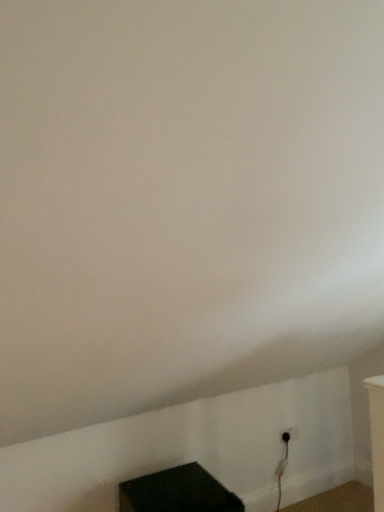
Question: From a real-world perspective, is black plastic outlet at lower right located beneath black matte cube at lower center?

Choices:
 (A) no
 (B) yes

Answer: (A)

Question: Is black plastic outlet at lower right bigger than black matte cube at lower center?

Choices:
 (A) yes
 (B) no

Answer: (B)

Question: Does black plastic outlet at lower right have a greater width compared to black matte cube at lower center?

Choices:
 (A) yes
 (B) no

Answer: (B)

Question: Is black plastic outlet at lower right facing towards black matte cube at lower center?

Choices:
 (A) no
 (B) yes

Answer: (A)

Question: Is black plastic outlet at lower right positioned before black matte cube at lower center?

Choices:
 (A) no
 (B) yes

Answer: (A)

Question: Is black matte cube at lower center surrounded by black plastic outlet at lower right?

Choices:
 (A) no
 (B) yes

Answer: (A)

Question: From a real-world perspective, does black matte cube at lower center stand above black plastic outlet at lower right?

Choices:
 (A) no
 (B) yes

Answer: (A)

Question: Is black matte cube at lower center to the left of black plastic outlet at lower right from the viewer's perspective?

Choices:
 (A) yes
 (B) no

Answer: (A)

Question: Can you confirm if black matte cube at lower center is positioned to the right of black plastic outlet at lower right?

Choices:
 (A) no
 (B) yes

Answer: (A)

Question: Is the position of black matte cube at lower center more distant than that of black plastic outlet at lower right?

Choices:
 (A) no
 (B) yes

Answer: (A)

Question: Is black matte cube at lower center positioned far away from black plastic outlet at lower right?

Choices:
 (A) yes
 (B) no

Answer: (B)

Question: Is black matte cube at lower center positioned with its back to black plastic outlet at lower right?

Choices:
 (A) yes
 (B) no

Answer: (B)

Question: From a real-world perspective, is black plastic outlet at lower right positioned above or below black matte cube at lower center?

Choices:
 (A) above
 (B) below

Answer: (A)